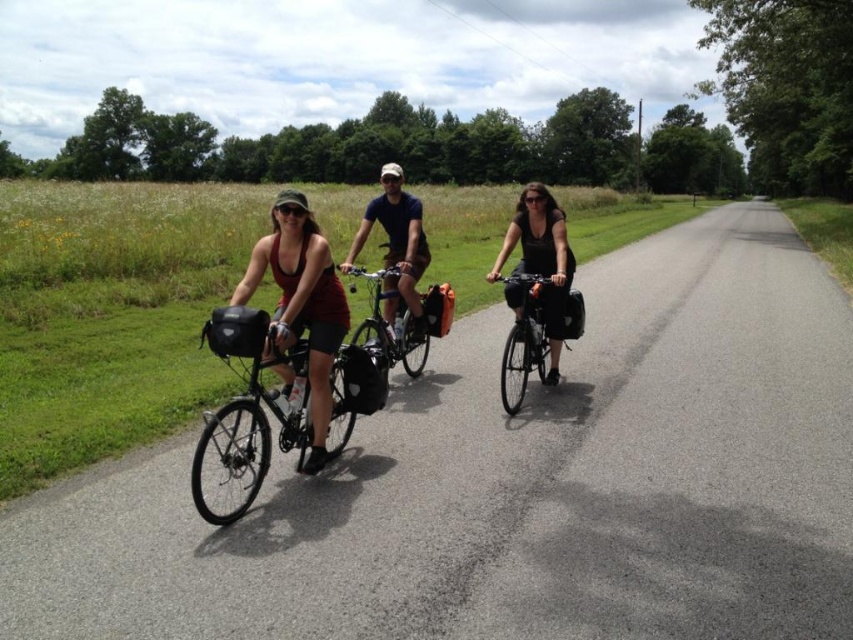
Looking at this image, who is higher up, shiny black bicycle at center or shiny metallic bicycle at center?

shiny metallic bicycle at center

Is point (572, 301) positioned before point (410, 340)?

Yes, point (572, 301) is in front of point (410, 340).

You are a GUI agent. You are given a task and a screenshot of the screen. Output one action in this format:
    pyautogui.click(x=<x>, y=<y>)
    Task: Click on the shiny black bicycle at center
    
    Given the screenshot: What is the action you would take?
    click(x=525, y=337)

Is point (316, 330) positioned behind point (294, 424)?

Yes, point (316, 330) is farther from viewer.

Does matte red tank top at center come in front of shiny black bicycle at center-left?

No, matte red tank top at center is behind shiny black bicycle at center-left.

Locate an element on the screen. Image resolution: width=853 pixels, height=640 pixels. matte red tank top at center is located at coordinates (302, 301).

Between shiny black bicycle at center-left and black matte dress at center, which one has more height?

black matte dress at center

Is shiny black bicycle at center-left further to the viewer compared to black matte dress at center?

That is False.

Does point (347, 420) lie behind point (563, 269)?

No, it is not.

Where is `shiny black bicycle at center-left`? The height and width of the screenshot is (640, 853). shiny black bicycle at center-left is located at coordinates (250, 404).